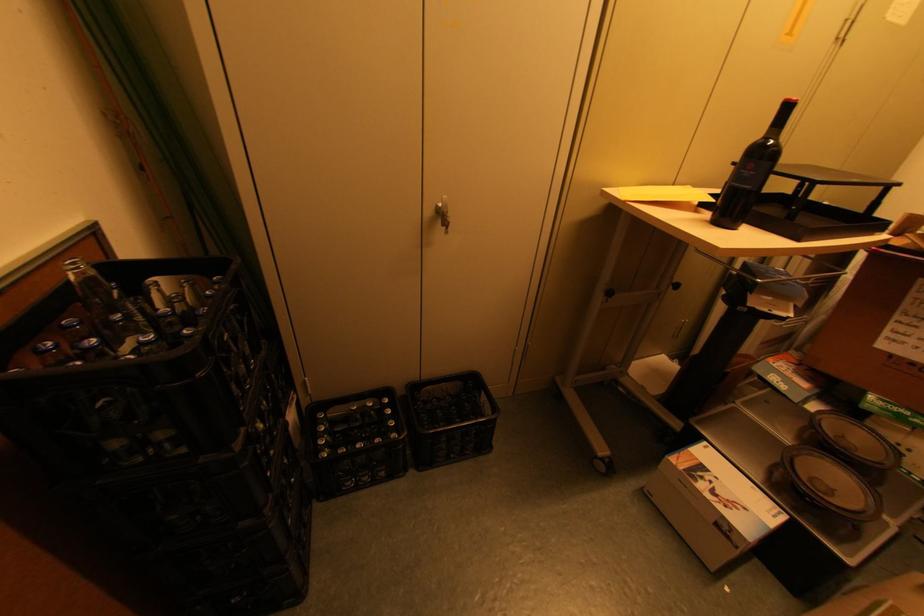
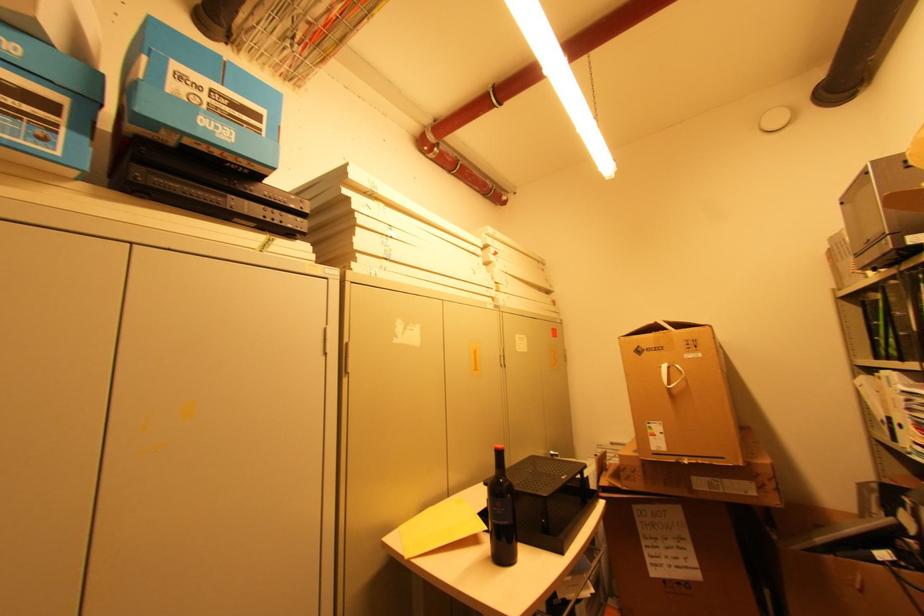
Locate, in the second image, the point that corresponds to pixel 710 222 in the first image.

(492, 559)